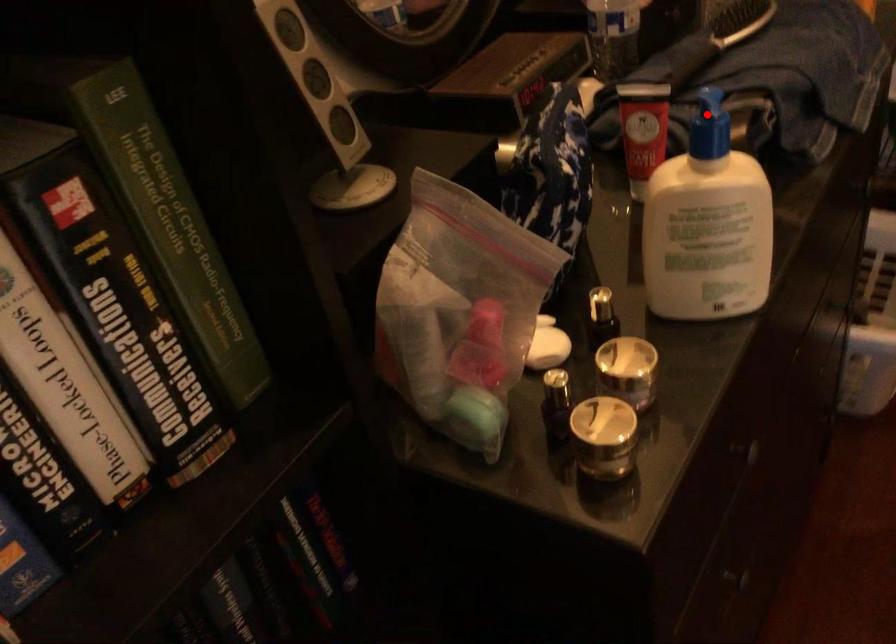
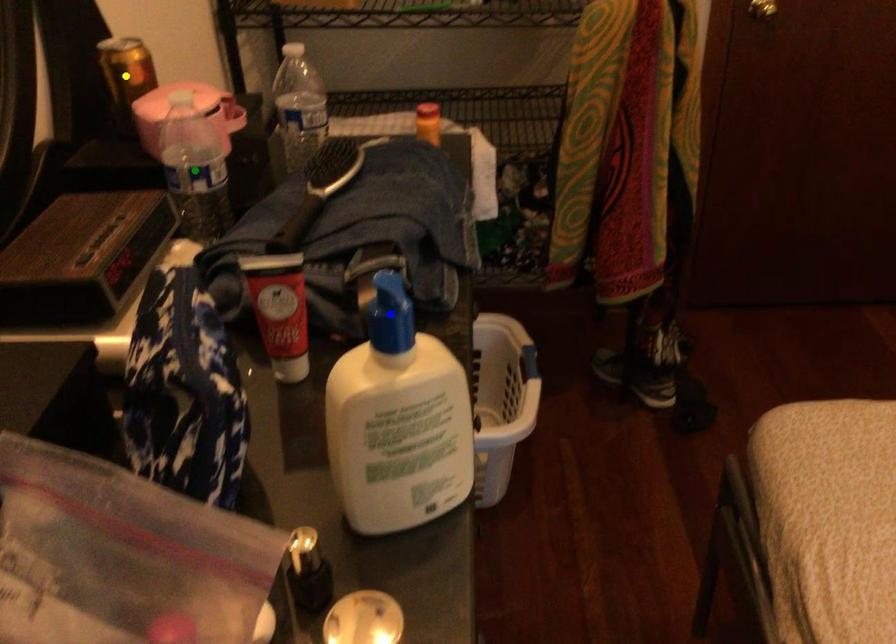
Question: I am providing you with two images of the same scene from different viewpoints. A red point is marked on the first image. You are given multiple points on the second image. In image 2, which mark is for the same physical point as the one in image 1?

Choices:
 (A) green point
 (B) blue point
 (C) yellow point

Answer: (B)